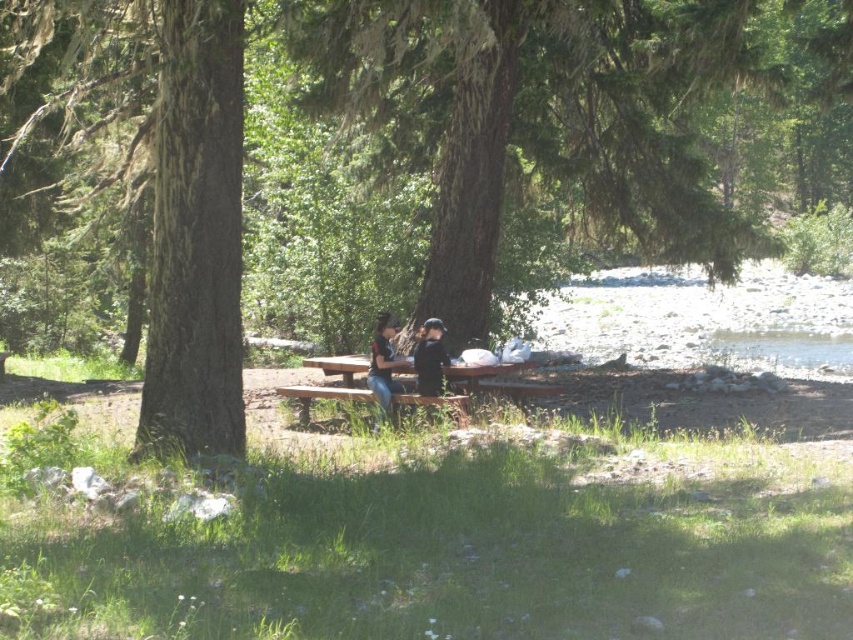
Consider the image. You are standing at the picnic table shaded by the green mossy tree trunk at center. If you want to walk directly towards the river visible on the right side of the image, which direction should you face relative to the tree trunk?

Since the river is on the right side of the image and the green mossy tree trunk at center is located at point [196,236], you should face towards the right direction relative to the tree trunk to walk directly towards the river.